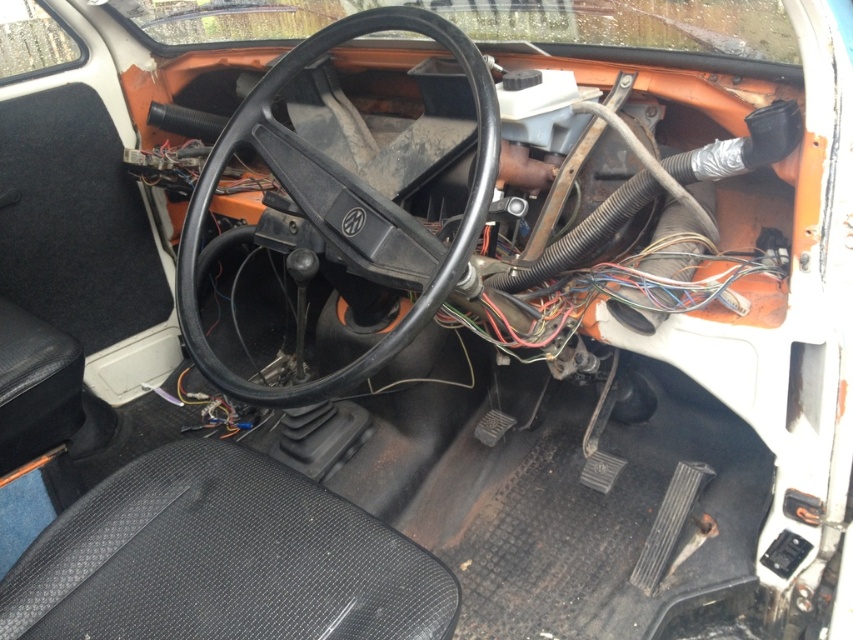
Is black textured seat at lower left closer to the viewer compared to black matte steering wheel at center?

Result: Yes.

Does black textured seat at lower left have a lesser height compared to black matte steering wheel at center?

Correct, black textured seat at lower left is not as tall as black matte steering wheel at center.

Is point (280, 522) less distant than point (386, 22)?

Yes, it is in front of point (386, 22).

Find the location of `black textured seat at lower left`. black textured seat at lower left is located at coordinates (222, 560).